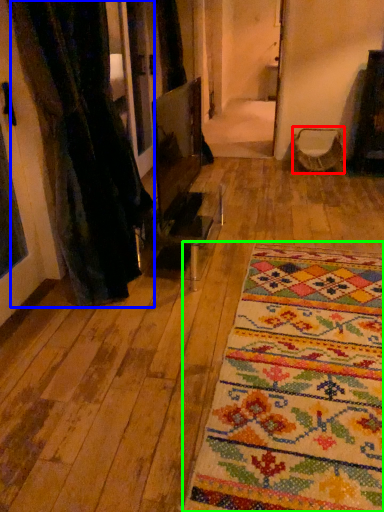
Question: Estimate the real-world distances between objects in this image. Which object is farther from armchair (highlighted by a red box), curtain (highlighted by a blue box) or mat (highlighted by a green box)?

Choices:
 (A) curtain
 (B) mat

Answer: (B)